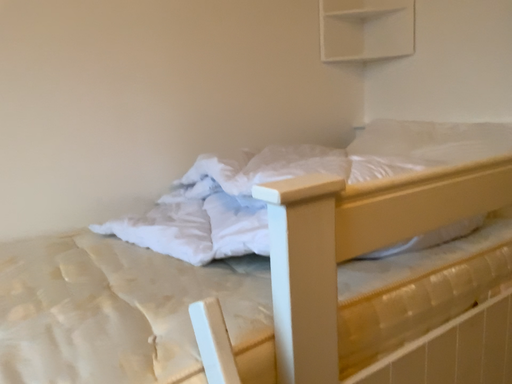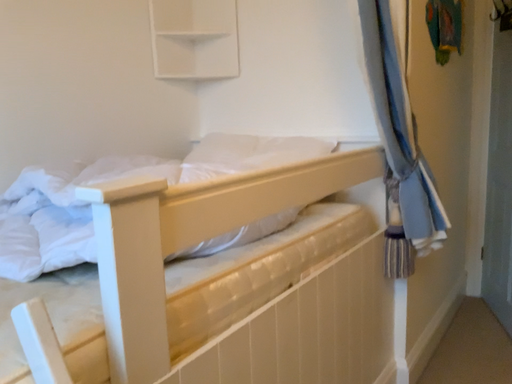
Question: How did the camera likely rotate when shooting the video?

Choices:
 (A) rotated right
 (B) rotated left

Answer: (A)